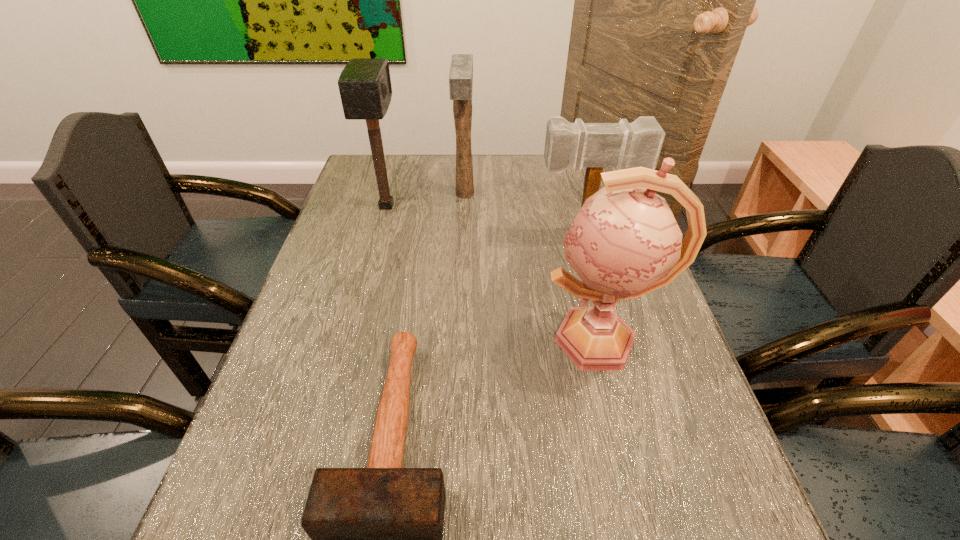
This screenshot has width=960, height=540. I want to click on object situated at the far left corner, so click(364, 84).

At what (x,y) coordinates should I click in order to perform the action: click on vacant space at the far edge of the desktop. Please return your answer as a coordinate pair (x, y). The width and height of the screenshot is (960, 540). Looking at the image, I should click on (417, 190).

This screenshot has height=540, width=960. Identify the location of free location at the left edge. (348, 244).

Identify the location of vacant point at the right edge. tap(616, 393).

Where is `free space at the far right corner of the desktop`? Image resolution: width=960 pixels, height=540 pixels. free space at the far right corner of the desktop is located at coordinates (562, 178).

Select which object appears as the closest to the shortest object. Please provide its 2D coordinates. Your answer should be formatted as a tuple, i.e. [(x, y)], where the tuple contains the x and y coordinates of a point satisfying the conditions above.

[(624, 243)]

Where is `object identified as the fourth closest to the globe`? object identified as the fourth closest to the globe is located at coordinates (364, 84).

Locate which mallet ranks in proximity to the shortest mallet. Please provide its 2D coordinates. Your answer should be formatted as a tuple, i.e. [(x, y)], where the tuple contains the x and y coordinates of a point satisfying the conditions above.

[(638, 144)]

Where is `the closest mallet to the rightmost mallet`? The height and width of the screenshot is (540, 960). the closest mallet to the rightmost mallet is located at coordinates (461, 72).